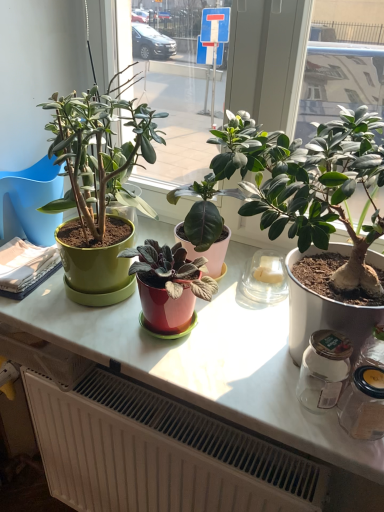
Question: Considering the relative positions of matte green plant at center, arranged as the second houseplant when viewed from the left, and green matte plant pot at left, which is counted as the 1th houseplant, starting from the left, in the image provided, is matte green plant at center, arranged as the second houseplant when viewed from the left, to the left or to the right of green matte plant pot at left, which is counted as the 1th houseplant, starting from the left,?

Choices:
 (A) right
 (B) left

Answer: (A)

Question: In terms of width, does matte green plant at center, arranged as the second houseplant when viewed from the left, look wider or thinner when compared to green matte plant pot at left, which is counted as the 1th houseplant, starting from the left?

Choices:
 (A) wide
 (B) thin

Answer: (B)

Question: Which of these objects is positioned closest to the matte green pot at left?

Choices:
 (A) green matte plant pot at left, marked as the 2th houseplant in a right-to-left arrangement
 (B) white matte radiator at lower center
 (C) matte green plant at center, arranged as the second houseplant when viewed from the left

Answer: (A)

Question: Which object is the closest to the green matte plant pot at left, marked as the 2th houseplant in a right-to-left arrangement?

Choices:
 (A) matte green pot at left
 (B) matte green plant at center, the 1th houseplant viewed from the right
 (C) white matte radiator at lower center

Answer: (A)